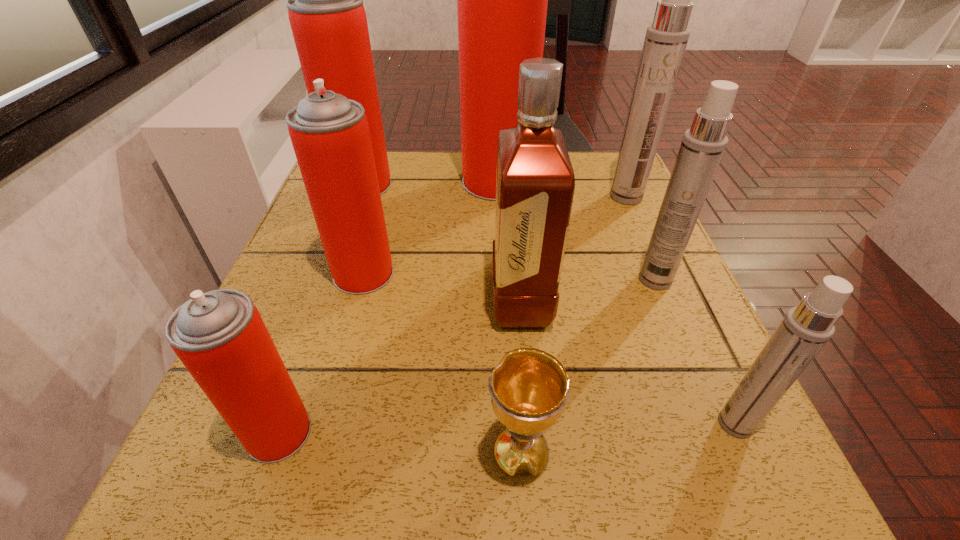
Where is `free spot between the biggest white aerosol can and the smallest white aerosol can`? The image size is (960, 540). free spot between the biggest white aerosol can and the smallest white aerosol can is located at coordinates (681, 310).

Find the location of a particular element. The width and height of the screenshot is (960, 540). free space between the second biggest white aerosol can and the gold chalice is located at coordinates (588, 367).

Identify the location of free spot between the third smallest red aerosol can and the liquor. (442, 243).

This screenshot has width=960, height=540. Identify the location of object identified as the eighth closest to the biggest white aerosol can. (220, 337).

I want to click on the eighth closest object to the fourth aerosol can from right to left, so click(x=805, y=329).

I want to click on the closest aerosol can to the nearest red aerosol can, so click(x=330, y=135).

The height and width of the screenshot is (540, 960). Find the location of `aerosol can that is the sixth closest to the second nearest white aerosol can`. aerosol can that is the sixth closest to the second nearest white aerosol can is located at coordinates (220, 337).

Identify which red aerosol can is the nearest to the second nearest red aerosol can. Please provide its 2D coordinates. Your answer should be formatted as a tuple, i.e. [(x, y)], where the tuple contains the x and y coordinates of a point satisfying the conditions above.

[(325, 6)]

Image resolution: width=960 pixels, height=540 pixels. Identify the location of the second closest red aerosol can to the rightmost red aerosol can. (330, 135).

I want to click on white aerosol can that is the third nearest to the liquor, so click(x=666, y=39).